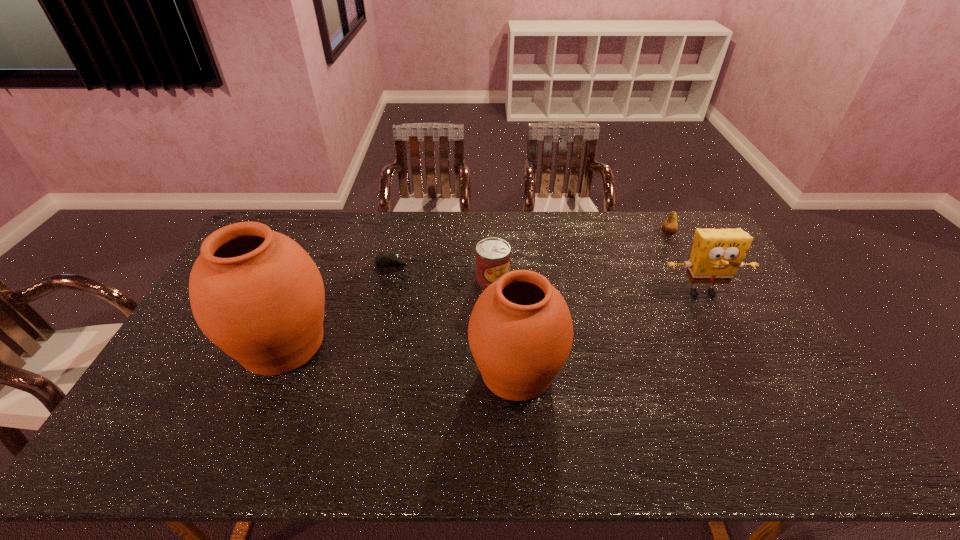
The image size is (960, 540). Find the location of `vacant space that satisfies the following two spatial constraints: 1. on the front side of the left urn; 2. on the left side of the second tallest object`. vacant space that satisfies the following two spatial constraints: 1. on the front side of the left urn; 2. on the left side of the second tallest object is located at coordinates click(x=272, y=372).

The width and height of the screenshot is (960, 540). What are the coordinates of `free location that satisfies the following two spatial constraints: 1. on the back side of the fifth shortest object; 2. on the left side of the pear` in the screenshot? It's located at (506, 233).

Locate an element on the screen. free location that satisfies the following two spatial constraints: 1. on the back side of the right urn; 2. on the button of the computer equipment is located at coordinates (509, 262).